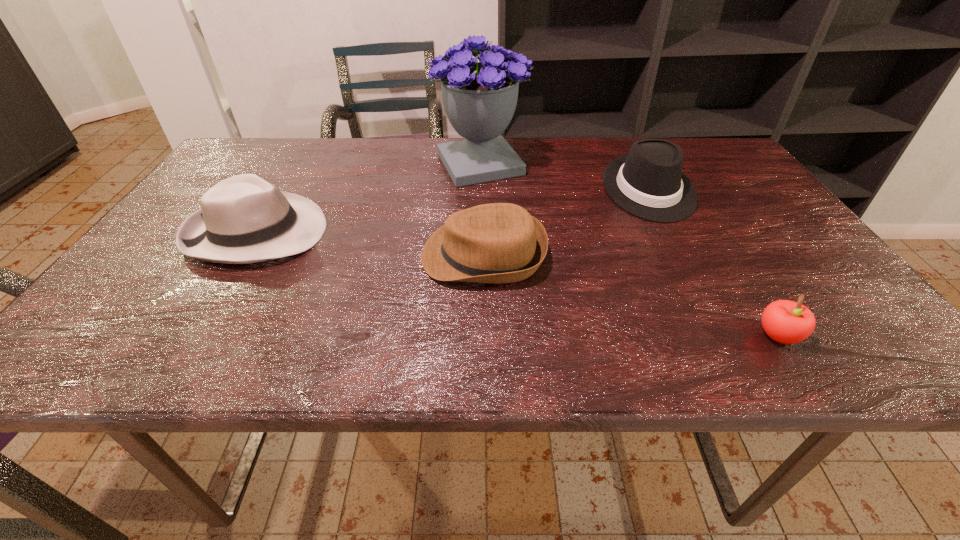
At what (x,y) coordinates should I click in order to perform the action: click on vacant space positioned 0.390m on the front-facing side of the second fedora from right to left. Please return your answer as a coordinate pair (x, y). Looking at the image, I should click on (242, 255).

Locate an element on the screen. This screenshot has width=960, height=540. vacant space located on the back of the apple is located at coordinates (725, 251).

You are a GUI agent. You are given a task and a screenshot of the screen. Output one action in this format:
    pyautogui.click(x=<x>, y=<y>)
    Task: Click on the bouquet that is at the far edge
    This screenshot has height=540, width=960.
    Given the screenshot: What is the action you would take?
    pyautogui.click(x=479, y=98)

Locate an element on the screen. The image size is (960, 540). fedora that is at the far edge is located at coordinates (648, 182).

Find the location of a particular element. This screenshot has height=540, width=960. object present at the near edge is located at coordinates (787, 322).

Locate an element on the screen. object that is at the left edge is located at coordinates (243, 219).

Where is `object positioned at the right edge`? The image size is (960, 540). object positioned at the right edge is located at coordinates (787, 322).

The image size is (960, 540). Find the location of `object located in the near right corner section of the desktop`. object located in the near right corner section of the desktop is located at coordinates (787, 322).

The image size is (960, 540). In order to click on free space at the far edge in this screenshot , I will do [x=590, y=151].

Image resolution: width=960 pixels, height=540 pixels. I want to click on vacant space at the near edge, so click(x=604, y=361).